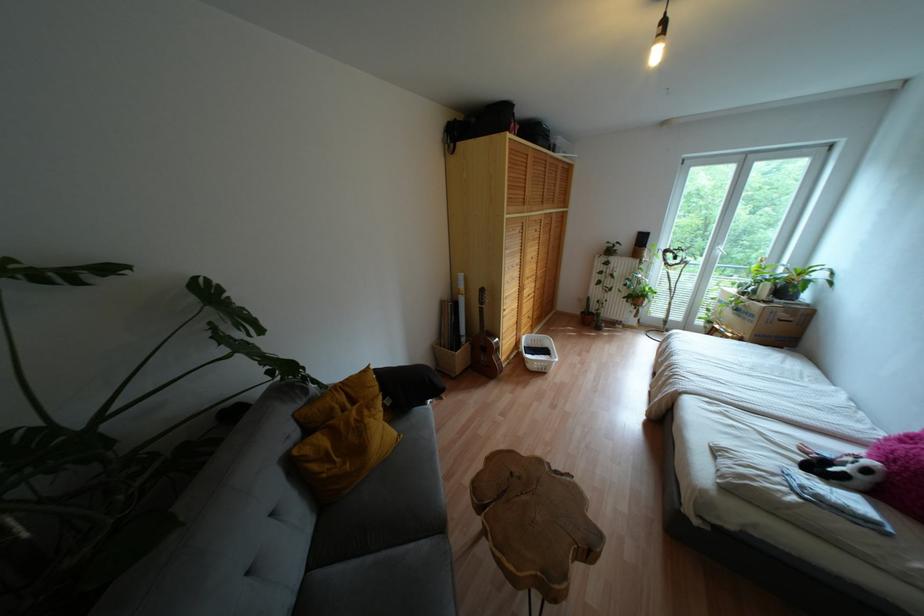
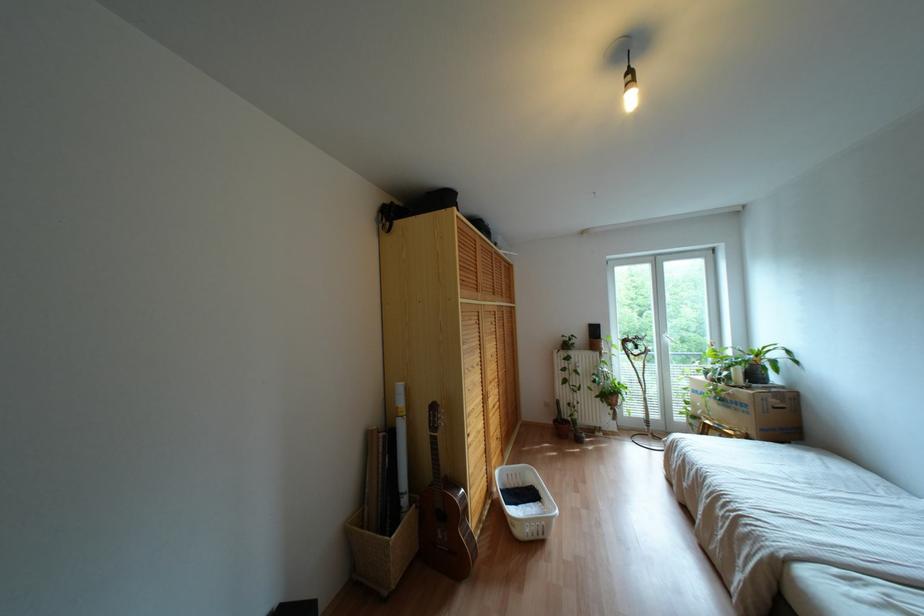
Question: Which direction would the cameraman need to move to produce the second image? Reply with the corresponding letter.

Choices:
 (A) Left
 (B) Right
 (C) Forward
 (D) Backward

Answer: (C)